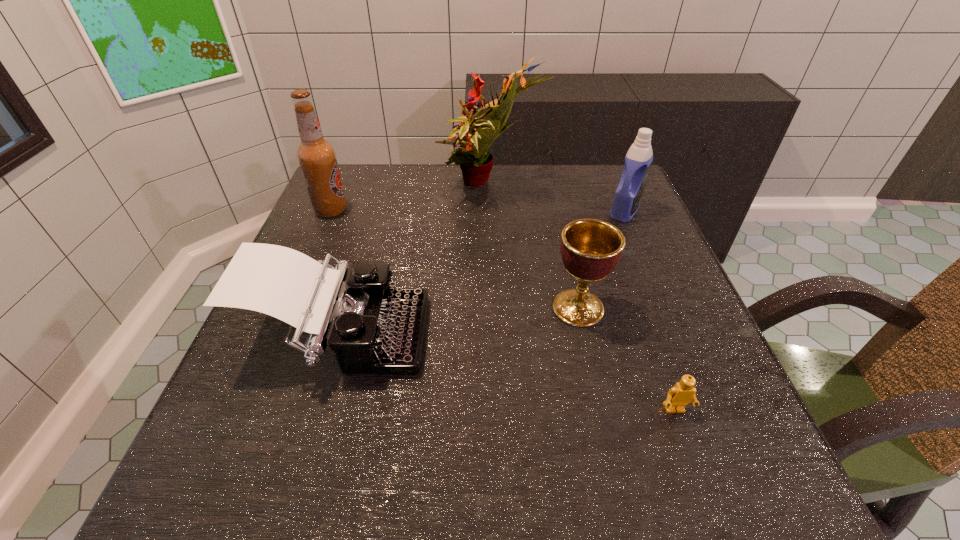
This screenshot has width=960, height=540. What are the coordinates of `bouquet` in the screenshot? It's located at (475, 162).

This screenshot has height=540, width=960. Find the location of `beer bottle`. beer bottle is located at coordinates (317, 157).

Locate an element on the screen. This screenshot has height=540, width=960. detergent is located at coordinates (637, 163).

Image resolution: width=960 pixels, height=540 pixels. I want to click on chalice, so click(590, 249).

Locate an element on the screen. The width and height of the screenshot is (960, 540). typewriter is located at coordinates (373, 328).

The height and width of the screenshot is (540, 960). I want to click on the shortest object, so click(678, 397).

Identify the location of Lego. This screenshot has height=540, width=960. (678, 397).

Locate an element on the screen. Image resolution: width=960 pixels, height=540 pixels. free space located 0.300m on the front-facing side of the bouquet is located at coordinates (328, 187).

Locate an element on the screen. blank space located 0.310m on the front-facing side of the bouquet is located at coordinates (324, 187).

Locate an element on the screen. The width and height of the screenshot is (960, 540). vacant space positioned 0.290m on the front-facing side of the bouquet is located at coordinates (331, 187).